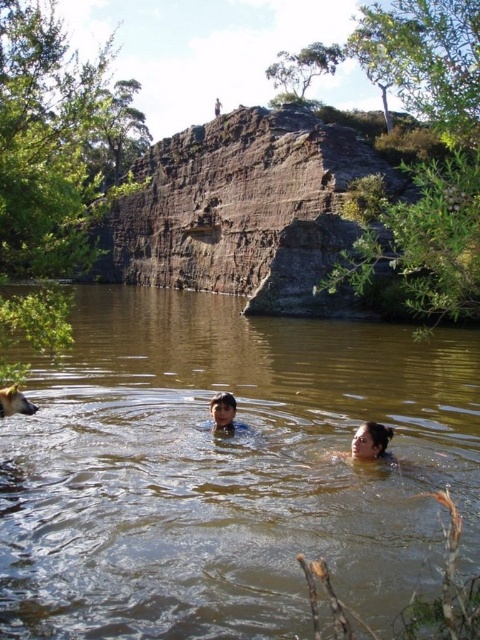
You are a photographer trying to capture a clear shot of the smooth skin face at lower center and the golden fur dog at lower left. Based on their positions, which one is closer to the camera?

The smooth skin face at lower center is closer to the camera than the golden fur dog at lower left because it is positioned in front of it.